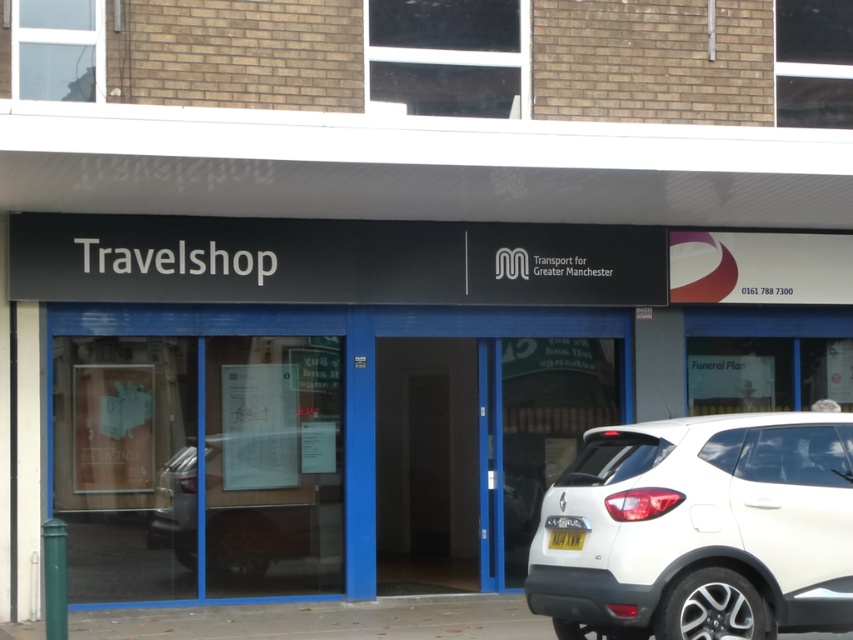
Is white matte suv at lower right below yellow plastic license plate at lower center?

Incorrect, white matte suv at lower right is not positioned below yellow plastic license plate at lower center.

Is point (844, 609) farther from camera compared to point (561, 540)?

No, (844, 609) is in front of (561, 540).

Who is more distant from viewer, (820, 448) or (579, 545)?

The point (820, 448) is more distant.

Find the location of a particular element. This screenshot has width=853, height=640. white matte suv at lower right is located at coordinates (701, 529).

Is white matte suv at lower right thinner than white glossy door at center?

Incorrect, white matte suv at lower right's width is not less than white glossy door at center's.

Can you confirm if white matte suv at lower right is wider than white glossy door at center?

Yes.

I want to click on white matte suv at lower right, so click(701, 529).

At what (x,y) coordinates should I click in order to perform the action: click on satin black suv at center. Please return your answer as a coordinate pair (x, y). The image size is (853, 640). Looking at the image, I should click on (268, 522).

Is satin black suv at center below yellow plastic license plate at lower center?

Yes.

Describe the element at coordinates (268, 522) in the screenshot. I see `satin black suv at center` at that location.

What are the coordinates of `satin black suv at center` in the screenshot? It's located at (268, 522).